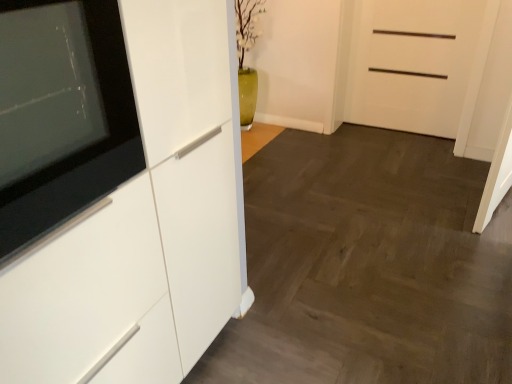
Question: Looking at their shapes, would you say white glossy cabinet at left is wider or thinner than white matte door at upper right?

Choices:
 (A) thin
 (B) wide

Answer: (B)

Question: Choose the correct answer: Is white glossy cabinet at left inside white matte door at upper right or outside it?

Choices:
 (A) outside
 (B) inside

Answer: (A)

Question: Which object is the closest to the black glossy tv at left?

Choices:
 (A) white glossy cabinet at left
 (B) white matte door at upper right

Answer: (A)

Question: Which object is positioned closest to the black glossy tv at left?

Choices:
 (A) white matte door at upper right
 (B) white glossy cabinet at left

Answer: (B)